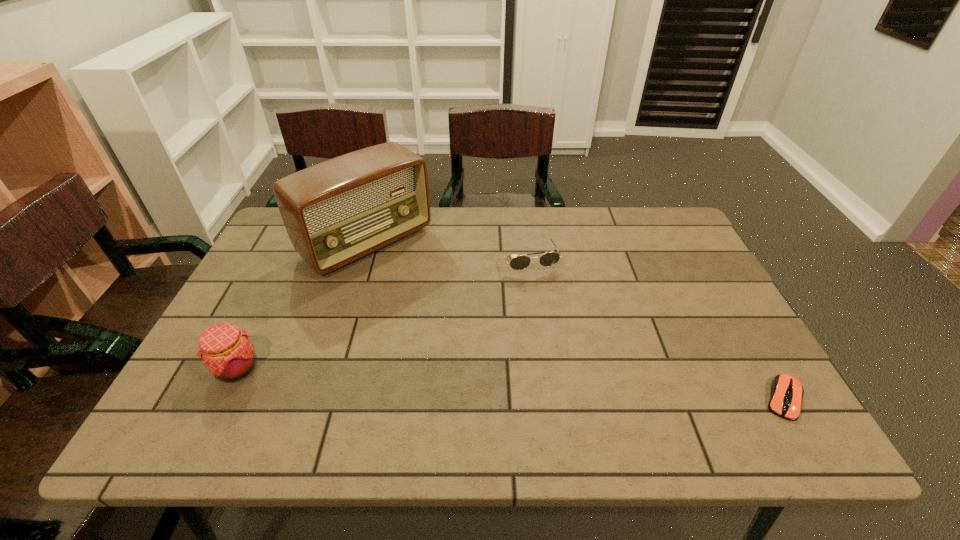
This screenshot has width=960, height=540. I want to click on object that ranks as the closest to the third object from left to right, so point(335,212).

You are a GUI agent. You are given a task and a screenshot of the screen. Output one action in this format:
    pyautogui.click(x=<x>, y=<y>)
    Task: Click on the vacant region that satisfies the following two spatial constraints: 1. on the back side of the second tallest object; 2. on the left side of the third object from left to right
    The image size is (960, 540).
    Given the screenshot: What is the action you would take?
    pyautogui.click(x=292, y=259)